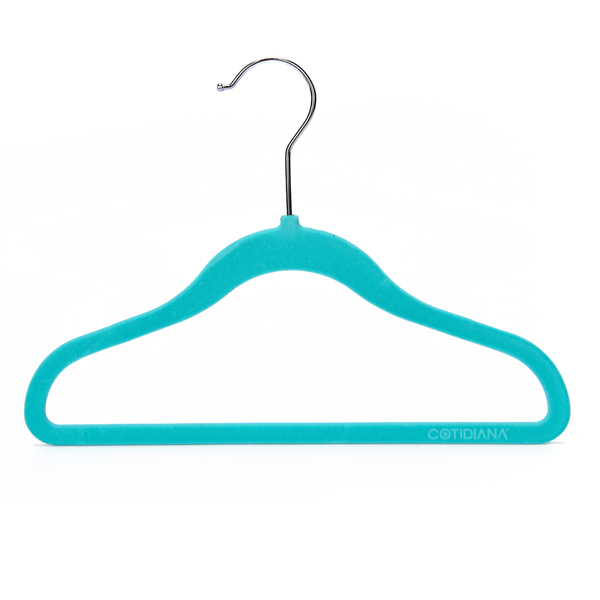
Can you point out all where you'd hang hanger in this image? Your answer should be formatted as a list of tuples, i.e. [(x1, y1), (x2, y2), ...], where each tuple contains the x and y coordinates of a point satisfying the conditions above.

[(310, 91)]